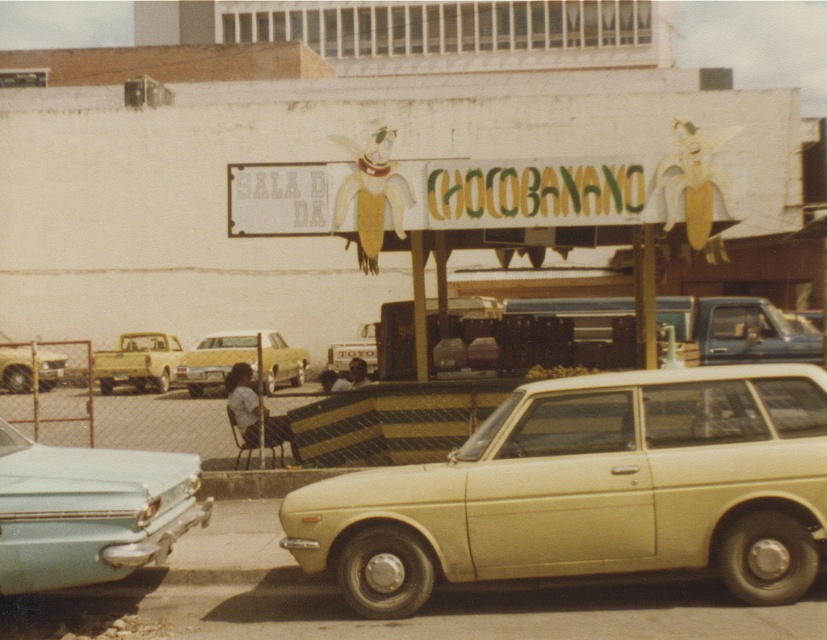
Is light blue metallic car at lower left to the right of matte yellow truck at left from the viewer's perspective?

Yes, light blue metallic car at lower left is to the right of matte yellow truck at left.

Is light blue metallic car at lower left to the left of matte yellow truck at left from the viewer's perspective?

No, light blue metallic car at lower left is not to the left of matte yellow truck at left.

Who is more distant from viewer, [142,509] or [134,372]?

The point [134,372] is more distant.

Locate an element on the screen. The image size is (827, 640). light blue metallic car at lower left is located at coordinates (88, 512).

Is yellow matte car at center closer to camera compared to light yellow car at left?

Yes, yellow matte car at center is closer to the viewer.

Can you confirm if yellow matte car at center is smaller than light yellow car at left?

No.

Who is more forward, [252,362] or [17,346]?

Point [252,362]

Locate an element on the screen. This screenshot has height=640, width=827. yellow matte car at center is located at coordinates (241, 362).

Who is positioned more to the left, beige matte station wagon at center or light yellow car at left?

light yellow car at left is more to the left.

Is beige matte station wagon at center thinner than light yellow car at left?

Yes, beige matte station wagon at center is thinner than light yellow car at left.

What do you see at coordinates (590, 490) in the screenshot?
I see `beige matte station wagon at center` at bounding box center [590, 490].

Find the location of `beige matte station wagon at center`. beige matte station wagon at center is located at coordinates point(590,490).